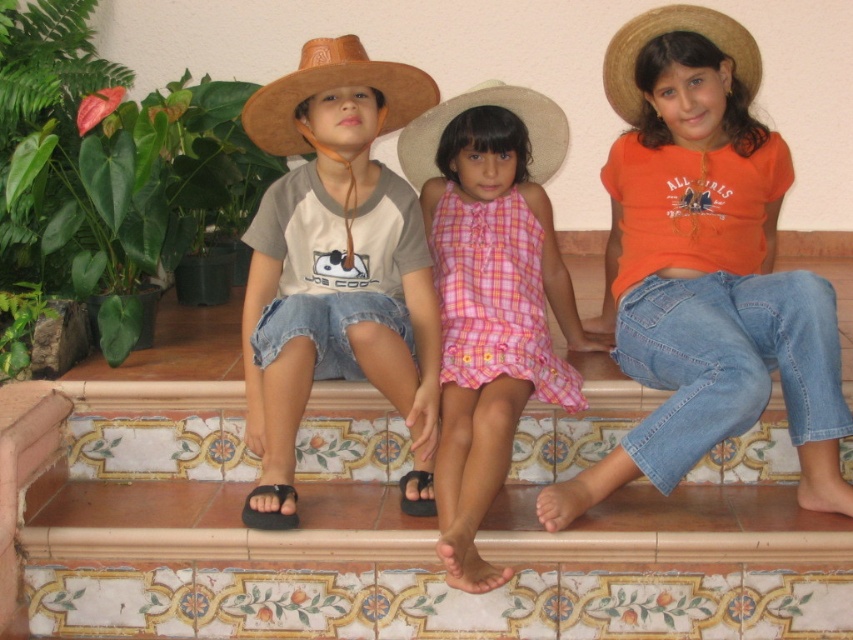
You are a photographer trying to capture a group shot of the children. You notice the pink plaid dress at center and the black rubber sandal at lower left. Which one should you focus on if you want to include the wider object in your frame?

The pink plaid dress at center is wider than the black rubber sandal at lower left, so you should focus on the pink plaid dress at center to include the wider object in your frame.